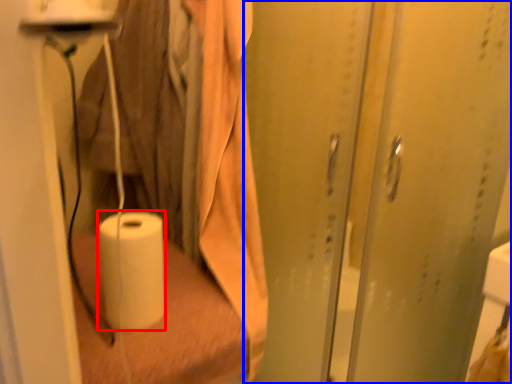
Question: Among these objects, which one is nearest to the camera, paper towel (highlighted by a red box) or screen door (highlighted by a blue box)?

Choices:
 (A) paper towel
 (B) screen door

Answer: (B)